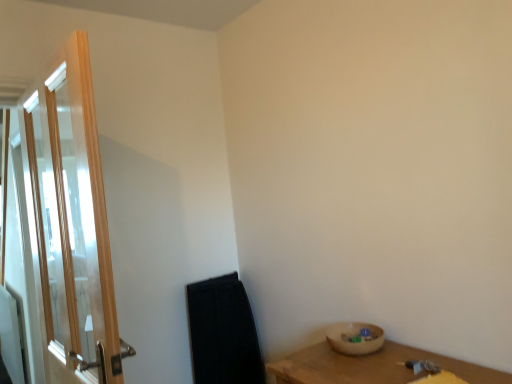
What is the approximate width of clear glass door at left?

6.88 inches.

Image resolution: width=512 pixels, height=384 pixels. I want to click on clear glass door at left, so click(x=72, y=229).

The image size is (512, 384). Describe the element at coordinates (72, 229) in the screenshot. I see `clear glass door at left` at that location.

Where is `wooden bowl at lower right`? The image size is (512, 384). wooden bowl at lower right is located at coordinates (356, 338).

What do you see at coordinates (356, 338) in the screenshot?
I see `wooden bowl at lower right` at bounding box center [356, 338].

From the picture: Measure the distance between wooden bowl at lower right and camera.

wooden bowl at lower right and camera are 4.76 feet apart from each other.

At what (x,y) coordinates should I click in order to perform the action: click on clear glass door at left. Please return your answer as a coordinate pair (x, y). Looking at the image, I should click on (72, 229).

Which object is positioned more to the right, clear glass door at left or wooden bowl at lower right?

Positioned to the right is wooden bowl at lower right.

Is clear glass door at left further to the viewer compared to wooden bowl at lower right?

No, clear glass door at left is in front of wooden bowl at lower right.

Considering the points (84, 126) and (357, 340), which point is behind, point (84, 126) or point (357, 340)?

The point (357, 340) is more distant.

From the image's perspective, which one is positioned higher, clear glass door at left or wooden bowl at lower right?

From the image's view, clear glass door at left is above.

From a real-world perspective, which object rests below the other?

wooden bowl at lower right is physically lower.

Can you confirm if clear glass door at left is thinner than wooden bowl at lower right?

Yes, clear glass door at left is thinner than wooden bowl at lower right.

In terms of height, does clear glass door at left look taller or shorter compared to wooden bowl at lower right?

clear glass door at left is taller than wooden bowl at lower right.

Who is smaller, clear glass door at left or wooden bowl at lower right?

wooden bowl at lower right is smaller.

Is clear glass door at left completely or partially outside of wooden bowl at lower right?

Yes, clear glass door at left is not within wooden bowl at lower right.

In the scene shown: Is clear glass door at left placed right next to wooden bowl at lower right?

No, clear glass door at left is not in contact with wooden bowl at lower right.

Is clear glass door at left aimed at wooden bowl at lower right?

No, clear glass door at left does not turn towards wooden bowl at lower right.

What's the angular difference between clear glass door at left and wooden bowl at lower right's facing directions?

clear glass door at left and wooden bowl at lower right are facing 0.106 degrees away from each other.

How distant is clear glass door at left from wooden bowl at lower right?

They are 1.03 meters apart.

At what (x,y) coordinates should I click in order to perform the action: click on basin below the clear glass door at left (from the image's perspective). Please return your answer as a coordinate pair (x, y). Looking at the image, I should click on (356, 338).

Consider the image. Which object is positioned more to the right, wooden bowl at lower right or clear glass door at left?

wooden bowl at lower right is more to the right.

Which object is closer to the camera, wooden bowl at lower right or clear glass door at left?

clear glass door at left is closer to the camera.

Does point (365, 350) come behind point (86, 107)?

Yes.

From the image's perspective, which is below, wooden bowl at lower right or clear glass door at left?

wooden bowl at lower right appears lower in the image.

From a real-world perspective, between wooden bowl at lower right and clear glass door at left, who is vertically higher?

In real-world perspective, clear glass door at left is above.

In the scene shown: Which object is wider, wooden bowl at lower right or clear glass door at left?

Wider between the two is wooden bowl at lower right.

Considering the sizes of objects wooden bowl at lower right and clear glass door at left in the image provided, who is taller, wooden bowl at lower right or clear glass door at left?

clear glass door at left is taller.

Who is bigger, wooden bowl at lower right or clear glass door at left?

clear glass door at left.

Would you say wooden bowl at lower right is inside or outside clear glass door at left?

wooden bowl at lower right is not enclosed by clear glass door at left.

Can you see wooden bowl at lower right touching clear glass door at left?

No, wooden bowl at lower right is not next to clear glass door at left.

Is clear glass door at left at the back of wooden bowl at lower right?

No, clear glass door at left is not at the back of wooden bowl at lower right.

How many degrees apart are the facing directions of wooden bowl at lower right and clear glass door at left?

0.106 degrees separate the facing orientations of wooden bowl at lower right and clear glass door at left.

Image resolution: width=512 pixels, height=384 pixels. I want to click on basin below the clear glass door at left (from a real-world perspective), so click(356, 338).

Locate an element on the screen. The image size is (512, 384). screen door on the left side of wooden bowl at lower right is located at coordinates (72, 229).

This screenshot has height=384, width=512. I want to click on basin on the right of clear glass door at left, so click(x=356, y=338).